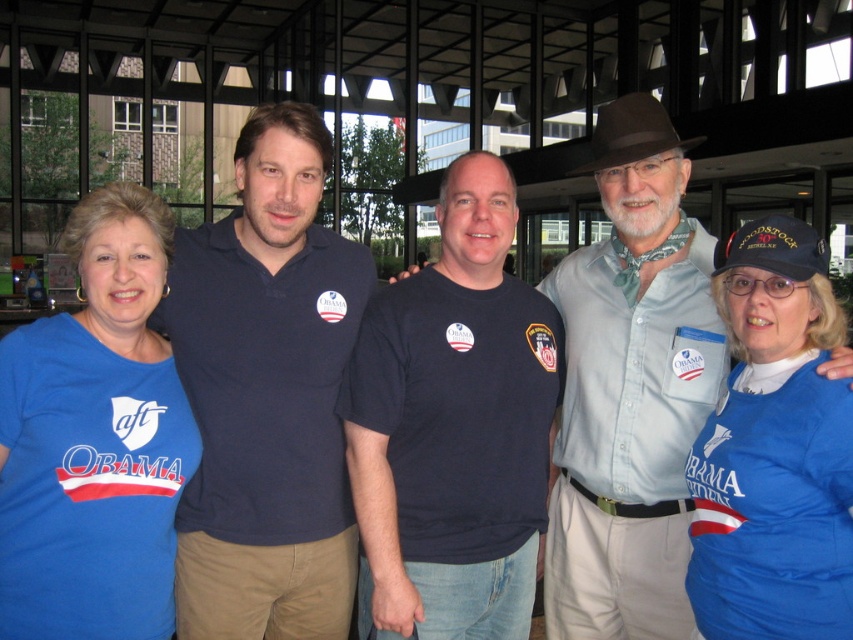
Question: Which of the following is the farthest from the observer?

Choices:
 (A) dark blue shirt at center
 (B) blue fabric shirt at center

Answer: (A)

Question: Where is blue fabric shirt at left located in relation to blue fabric shirt at center in the image?

Choices:
 (A) below
 (B) above

Answer: (B)

Question: Does dark blue shirt at center have a greater width compared to brown felt hat at center?

Choices:
 (A) no
 (B) yes

Answer: (B)

Question: Which of the following is the closest to the observer?

Choices:
 (A) (181, 577)
 (B) (125, 234)
 (C) (668, 140)
 (D) (753, 364)

Answer: (D)

Question: Observing the image, what is the correct spatial positioning of dark blue polo shirt at center in reference to dark blue shirt at center?

Choices:
 (A) right
 (B) left

Answer: (B)

Question: Which point is closer to the camera?

Choices:
 (A) blue fabric shirt at left
 (B) dark blue t-shirt at center

Answer: (A)